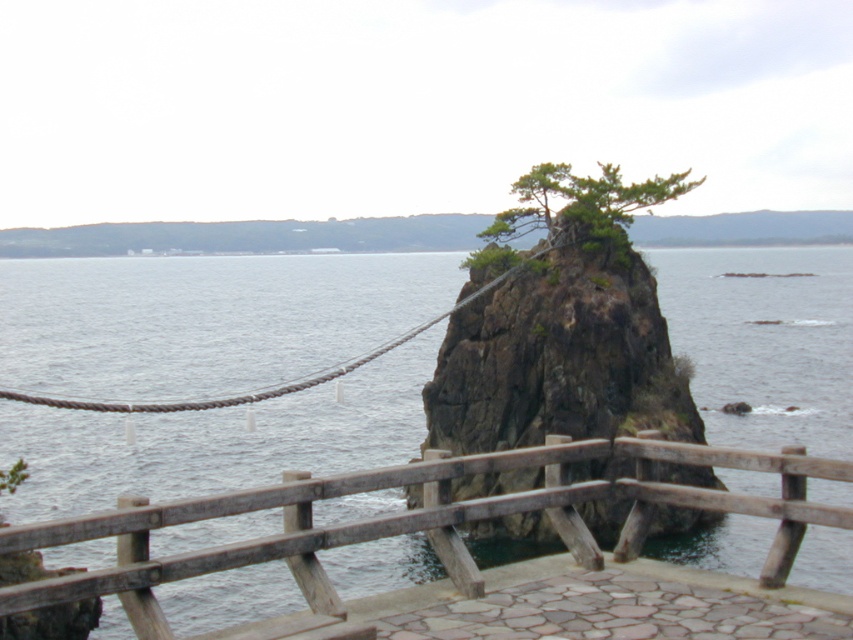
You are standing on the paved area in the foreground of the coastal scene. You notice two points marked on the rock formation in the center. The first point is at coordinates point(776, 500) and the second is at point(556, 538). Which of these two points is nearer to your current position?

Point(776, 500) is closer to the viewer than point(556, 538), so the first point is nearer to your current position on the paved area.

You are standing on the paved area in the foreground of the coastal scene. You want to reach the top of the rough textured rock at center to take a photo. According to the coordinates provided, is the rock located directly in front of you or to the side?

The rough textured rock at center is positioned at coordinates point (560, 356), which places it directly in front of you since it is at the center point of the scene.

You are a hiker planning to climb the rock formation. You see the wooden rail at center and the green rough textured tree at center. Which object should you grab for support?

The wooden rail at center is located below the green rough textured tree at center, so it is more accessible for grabbing as support.